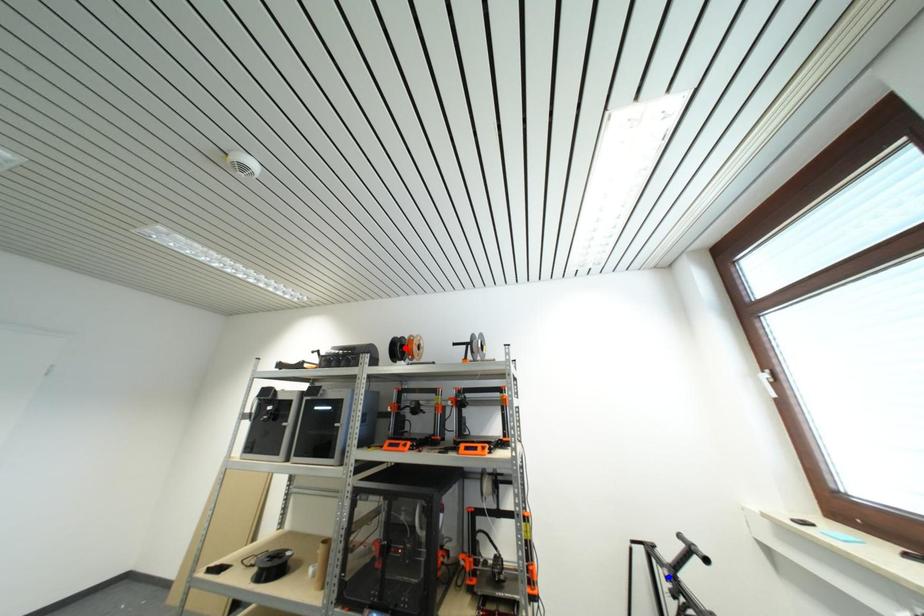
Question: Which of the two points in the image is closer to the camera?

Choices:
 (A) Blue point is closer.
 (B) Red point is closer.

Answer: (A)